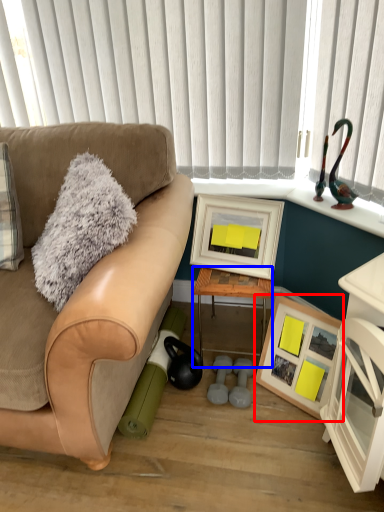
Question: Among these objects, which one is nearest to the camera, picture frame (highlighted by a red box) or table (highlighted by a blue box)?

Choices:
 (A) picture frame
 (B) table

Answer: (A)